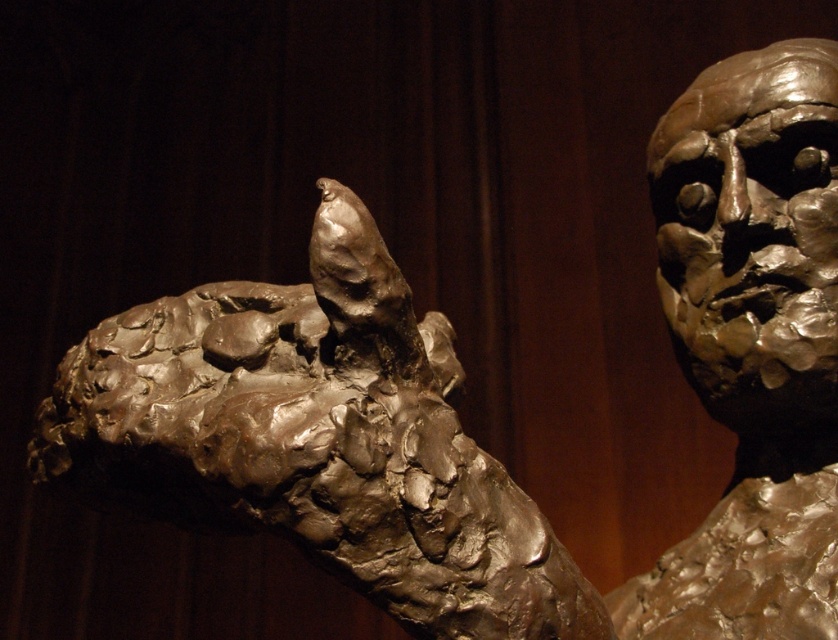
Question: Does matte bronze sculpture at center have a greater width compared to bronze textured bust at right?

Choices:
 (A) no
 (B) yes

Answer: (B)

Question: Which point is closer to the camera taking this photo?

Choices:
 (A) (794, 458)
 (B) (114, 376)

Answer: (B)

Question: Is matte bronze sculpture at center closer to camera compared to bronze textured bust at right?

Choices:
 (A) yes
 (B) no

Answer: (A)

Question: Is matte bronze sculpture at center bigger than bronze textured bust at right?

Choices:
 (A) no
 (B) yes

Answer: (B)